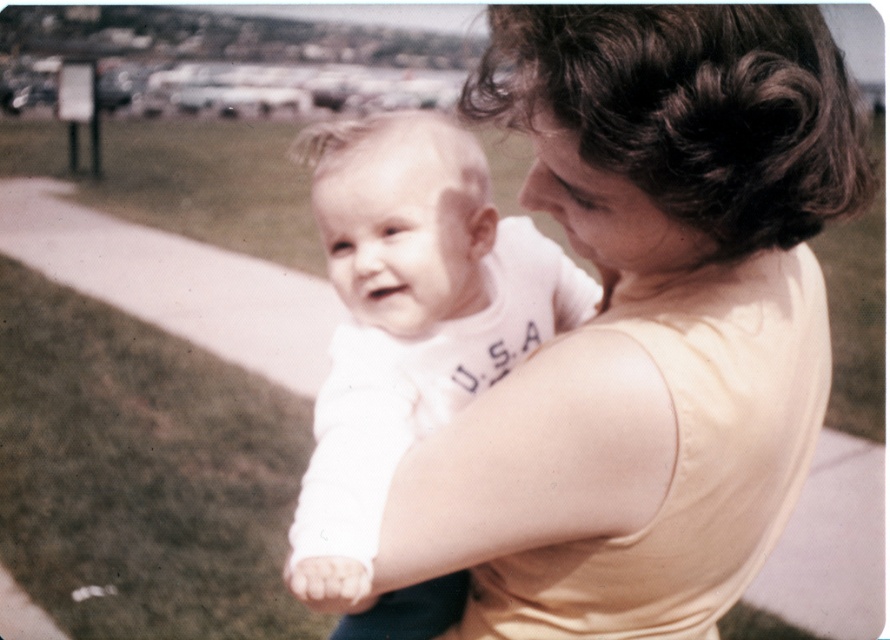
Question: Which of the following is the closest to the observer?

Choices:
 (A) (608, 557)
 (B) (419, 352)

Answer: (A)

Question: Does matte yellow tank top at center come behind white cotton shirt at center?

Choices:
 (A) yes
 (B) no

Answer: (B)

Question: Where is matte yellow tank top at center located in relation to white cotton shirt at center in the image?

Choices:
 (A) below
 (B) above

Answer: (A)

Question: Can you confirm if matte yellow tank top at center is thinner than white cotton shirt at center?

Choices:
 (A) no
 (B) yes

Answer: (A)

Question: Which object is farther from the camera taking this photo?

Choices:
 (A) matte yellow tank top at center
 (B) white cotton shirt at center

Answer: (B)